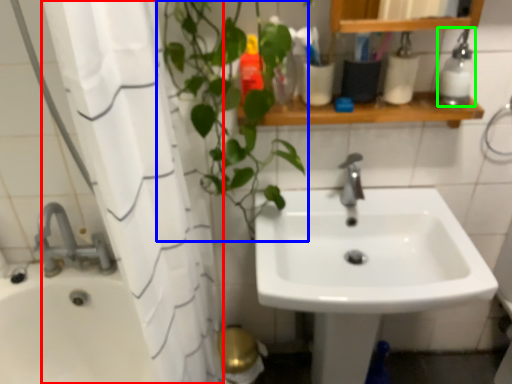
Question: Estimate the real-world distances between objects in this image. Which object is closer to shower curtain (highlighted by a red box), vegetation (highlighted by a blue box) or soap dispenser (highlighted by a green box)?

Choices:
 (A) vegetation
 (B) soap dispenser

Answer: (A)